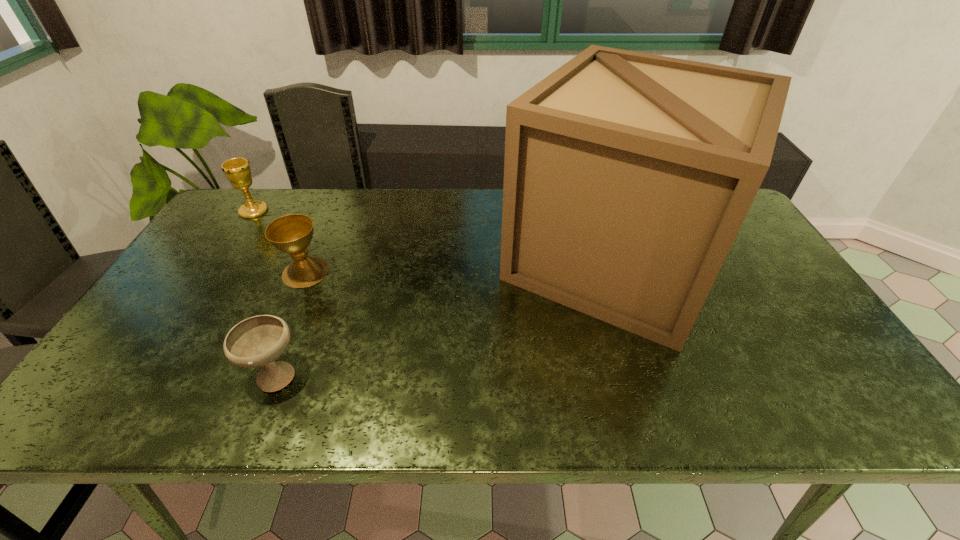
In the image, there is a desktop. Identify the location of vacant space at the right edge. The height and width of the screenshot is (540, 960). (x=804, y=304).

The image size is (960, 540). I want to click on blank space at the near left corner of the desktop, so click(x=152, y=402).

I want to click on free space between the second farthest chalice and the shortest object, so click(x=290, y=323).

Where is `empty space between the leftmost object and the rightmost object`? This screenshot has width=960, height=540. empty space between the leftmost object and the rightmost object is located at coordinates [x=434, y=235].

Locate an element on the screen. vacant space in between the second farthest chalice and the rightmost object is located at coordinates (460, 266).

At what (x,y) coordinates should I click in order to perform the action: click on free space between the second farthest chalice and the shortest chalice. Please return your answer as a coordinate pair (x, y). Looking at the image, I should click on (290, 323).

Find the location of `free area in between the leftmost object and the shortest chalice`. free area in between the leftmost object and the shortest chalice is located at coordinates (264, 293).

Identify the location of free point between the rightmost object and the shortest chalice. The height and width of the screenshot is (540, 960). (444, 317).

Locate an element on the screen. The height and width of the screenshot is (540, 960). vacant point located between the second nearest chalice and the nearest chalice is located at coordinates (290, 323).

Where is `free space that is in between the rightmost object and the shortest chalice`? The width and height of the screenshot is (960, 540). free space that is in between the rightmost object and the shortest chalice is located at coordinates (444, 317).